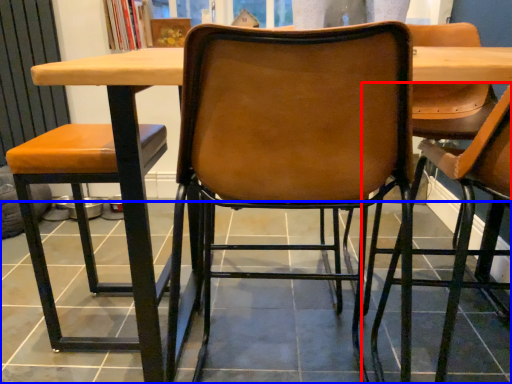
Question: Among these objects, which one is farthest to the camera, chair (highlighted by a red box) or tile (highlighted by a blue box)?

Choices:
 (A) chair
 (B) tile

Answer: (B)